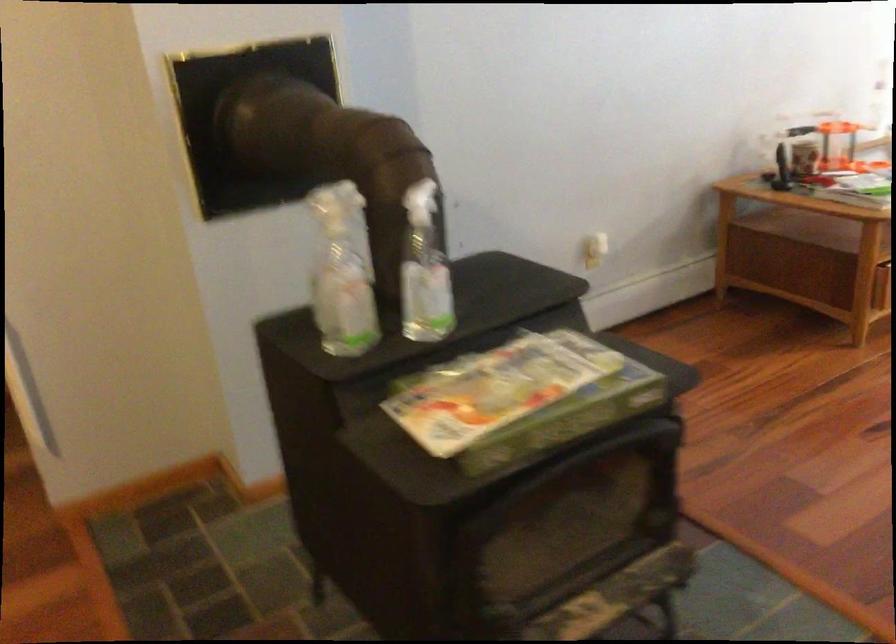
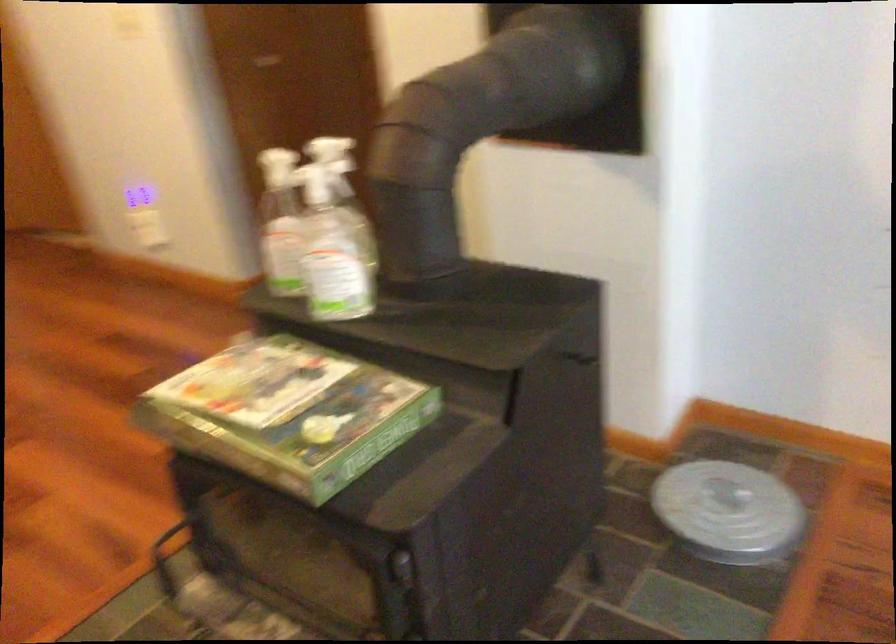
Find the pixel in the second image that matches [342,212] in the first image.

(278, 167)